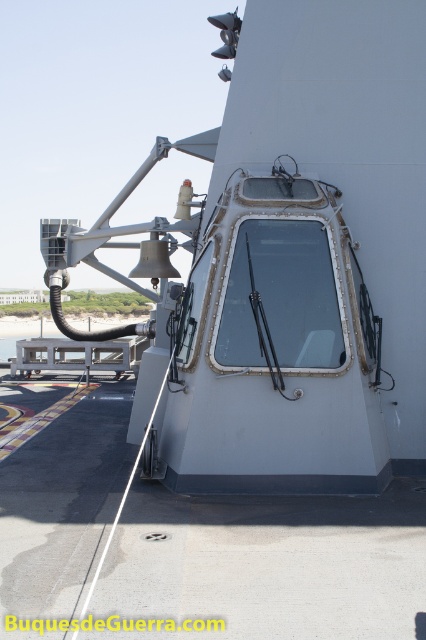
Does gray concrete tarmac at center have a greater height compared to transparent glass window at center?

No, gray concrete tarmac at center is not taller than transparent glass window at center.

Identify the location of gray concrete tarmac at center. (270, 563).

Describe the element at coordinates (270, 563) in the screenshot. The image size is (426, 640). I see `gray concrete tarmac at center` at that location.

The height and width of the screenshot is (640, 426). I want to click on gray concrete tarmac at center, so click(270, 563).

Who is higher up, gray metallic hatch at center or white matte deck at center?

white matte deck at center is above.

The height and width of the screenshot is (640, 426). I want to click on gray metallic hatch at center, so click(x=293, y=262).

Describe the element at coordinates (293, 262) in the screenshot. This screenshot has height=640, width=426. I see `gray metallic hatch at center` at that location.

Locate an element on the screen. gray metallic hatch at center is located at coordinates coord(293,262).

Does gray metallic hatch at center have a greater height compared to gray concrete tarmac at center?

Yes.

Is point (267, 269) in front of point (19, 584)?

No.

Does point (293, 33) lie in front of point (416, 572)?

No, it is not.

Locate an element on the screen. The image size is (426, 640). gray metallic hatch at center is located at coordinates (293, 262).